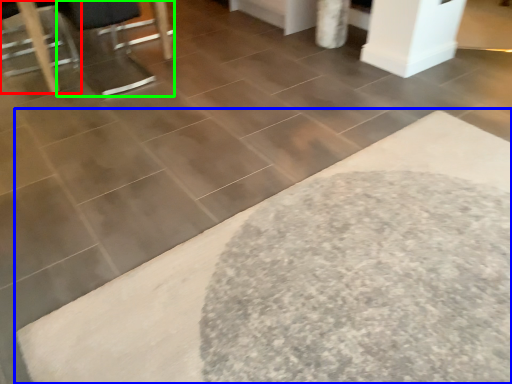
Question: Considering the real-world distances, which object is closest to furniture (highlighted by a red box)? bath mat (highlighted by a blue box) or swivel chair (highlighted by a green box).

Choices:
 (A) bath mat
 (B) swivel chair

Answer: (B)